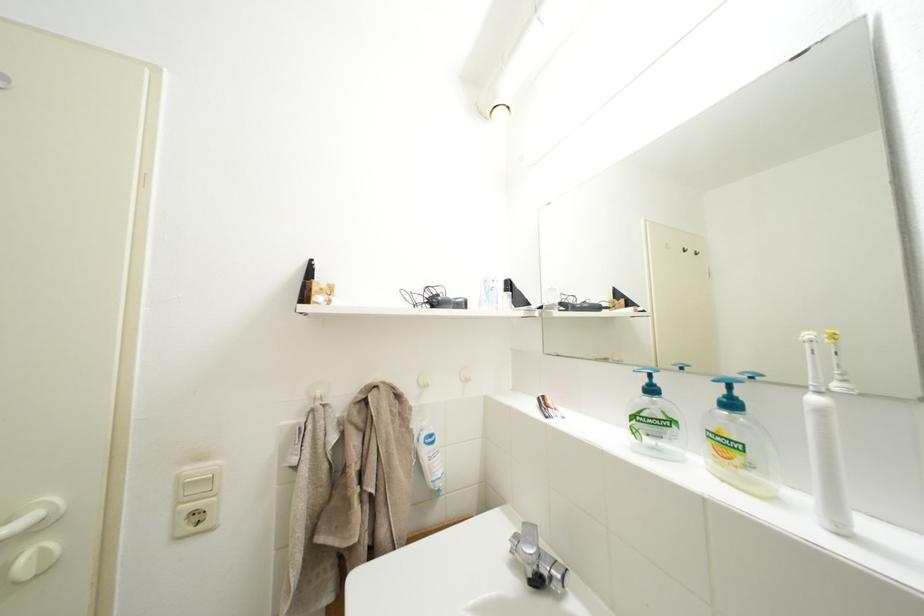
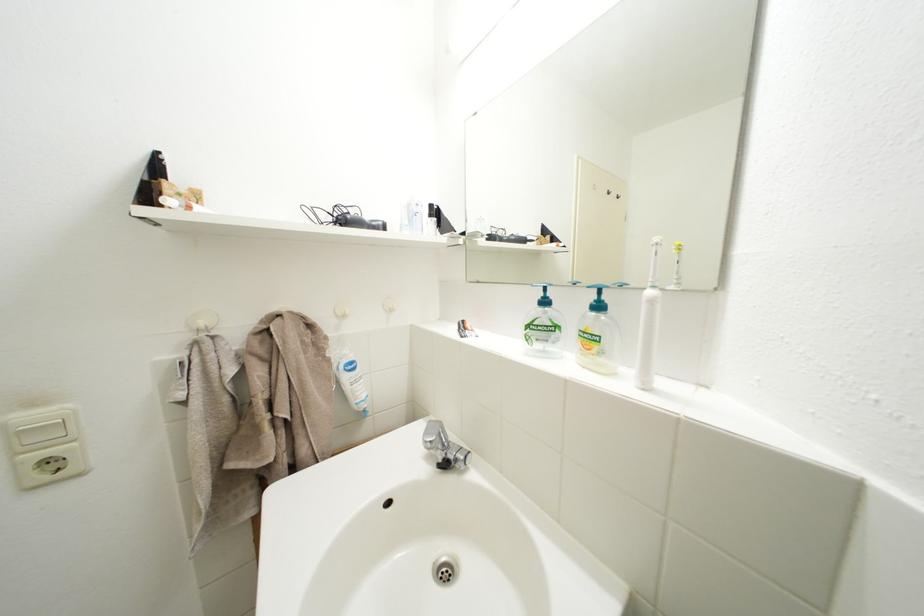
Find the pixel in the second image that matches [540,549] in the first image.

(441, 440)